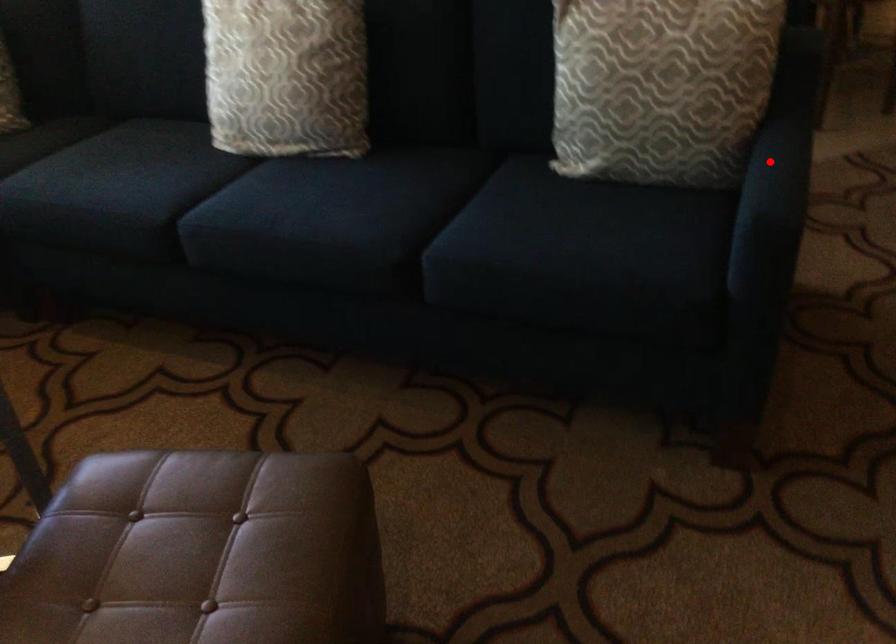
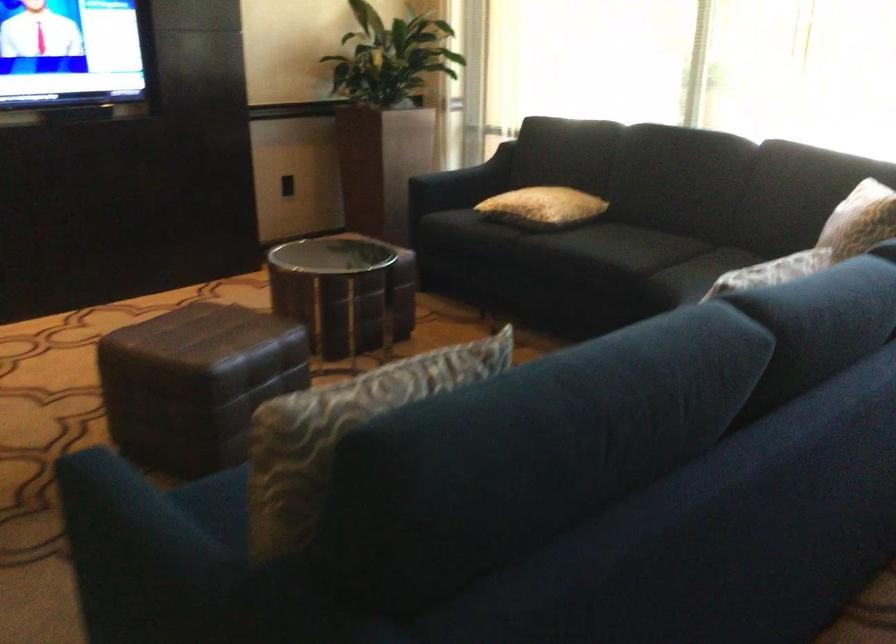
Question: I am providing you with two images of the same scene from different viewpoints. A red point is shown in image1. For the corresponding object point in image2, is it positioned nearer or farther from the camera?

Choices:
 (A) Nearer
 (B) Farther

Answer: (A)